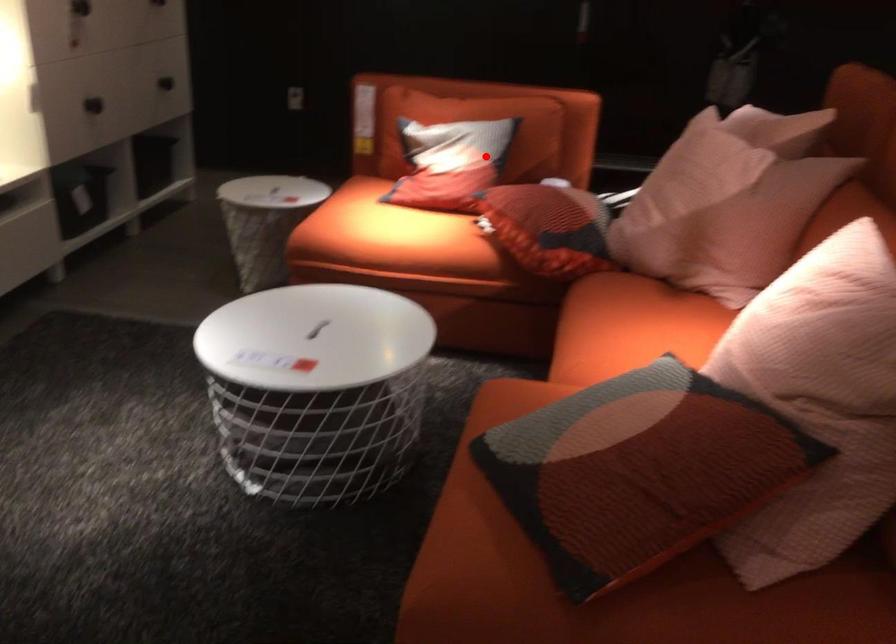
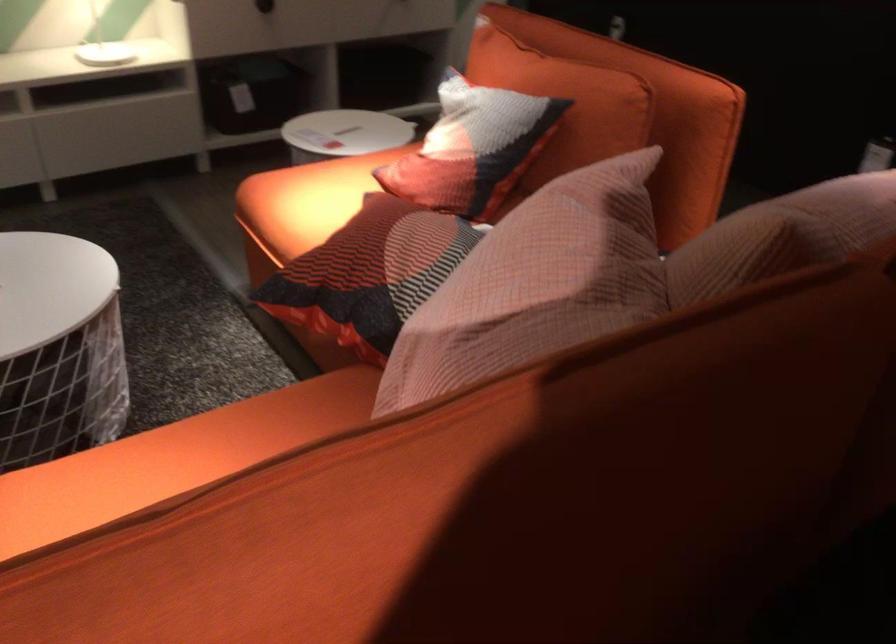
Locate, in the second image, the point that corresponds to the highlighted location in the first image.

(472, 147)